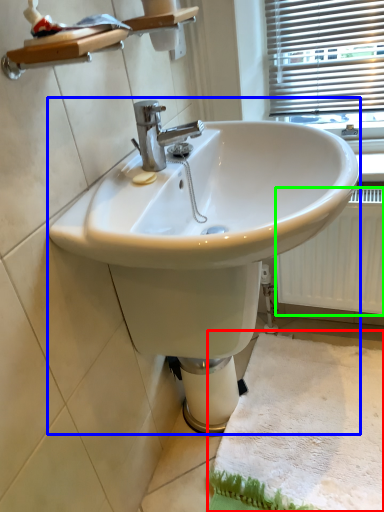
Question: Estimate the real-world distances between objects in this image. Which object is closer to bath mat (highlighted by a red box), sink (highlighted by a blue box) or radiator (highlighted by a green box)?

Choices:
 (A) sink
 (B) radiator

Answer: (B)